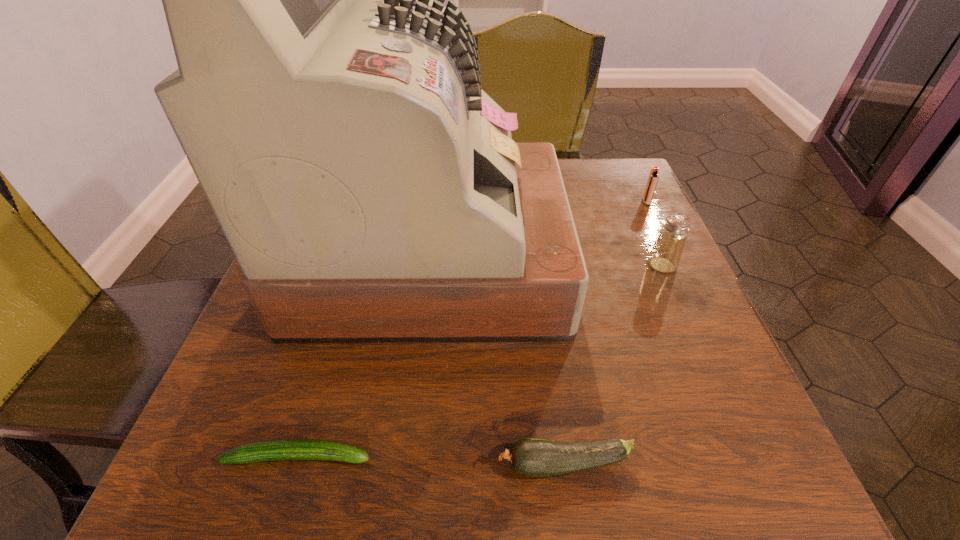
The image size is (960, 540). I want to click on free space between the tallest object and the second shortest object, so click(498, 361).

Locate an element on the screen. free space that is in between the taller zucchini and the tallest object is located at coordinates (498, 361).

The image size is (960, 540). I want to click on empty space between the right zucchini and the igniter, so click(606, 333).

This screenshot has height=540, width=960. What are the coordinates of `blank region between the fourth shortest object and the right zucchini` in the screenshot? It's located at (613, 364).

Select which object is the third closest to the tallest object. Please provide its 2D coordinates. Your answer should be formatted as a tuple, i.e. [(x, y)], where the tuple contains the x and y coordinates of a point satisfying the conditions above.

[(532, 457)]

Where is `object identified as the third closest to the third shortest object`? object identified as the third closest to the third shortest object is located at coordinates (532, 457).

What are the coordinates of `vacant space that satisfies the following two spatial constraints: 1. on the operating side of the cash register; 2. on the right side of the fourth shortest object` in the screenshot? It's located at (431, 265).

Identify the location of vacant area that satisfies the following two spatial constraints: 1. on the operating side of the second tallest object; 2. on the left side of the cash register. This screenshot has width=960, height=540. (431, 265).